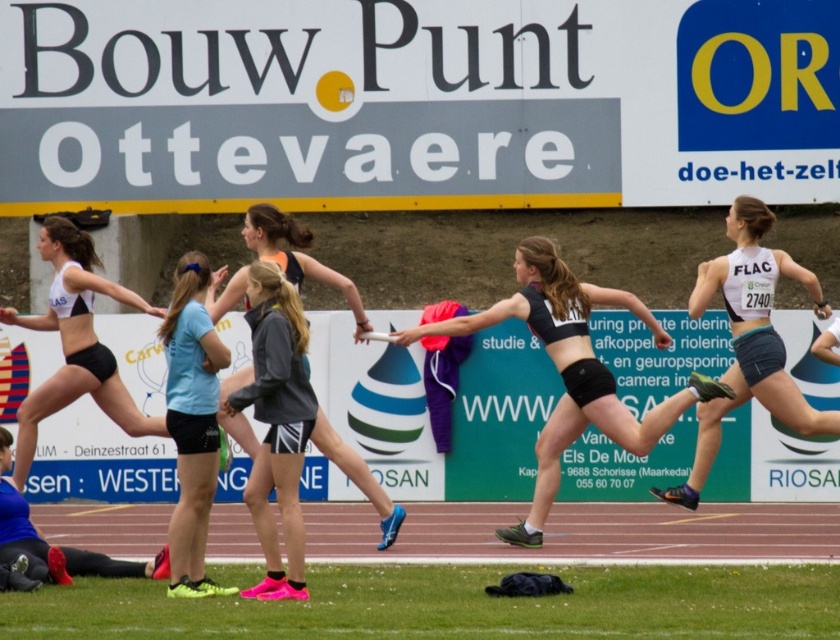
Question: Which of these objects is positioned farthest from the white matte tank top at right?

Choices:
 (A) blue synthetic track shoe at lower left
 (B) gray matte jacket at center

Answer: (A)

Question: Can you confirm if gray matte jacket at center is positioned to the left of black matte jacket at center?

Choices:
 (A) no
 (B) yes

Answer: (B)

Question: Which of the following is the farthest from the observer?

Choices:
 (A) light blue fabric shirt at center
 (B) blue synthetic track shoe at lower left

Answer: (B)

Question: Does black matte jacket at center have a larger size compared to blue synthetic track shoe at lower left?

Choices:
 (A) no
 (B) yes

Answer: (A)

Question: Is black matte sports bra at center below black matte jacket at center?

Choices:
 (A) yes
 (B) no

Answer: (B)

Question: Which point is farther to the camera?

Choices:
 (A) black matte sports bra at center
 (B) gray matte jacket at center
 (C) white matte tank top at right
 (D) light blue fabric shirt at center

Answer: (C)